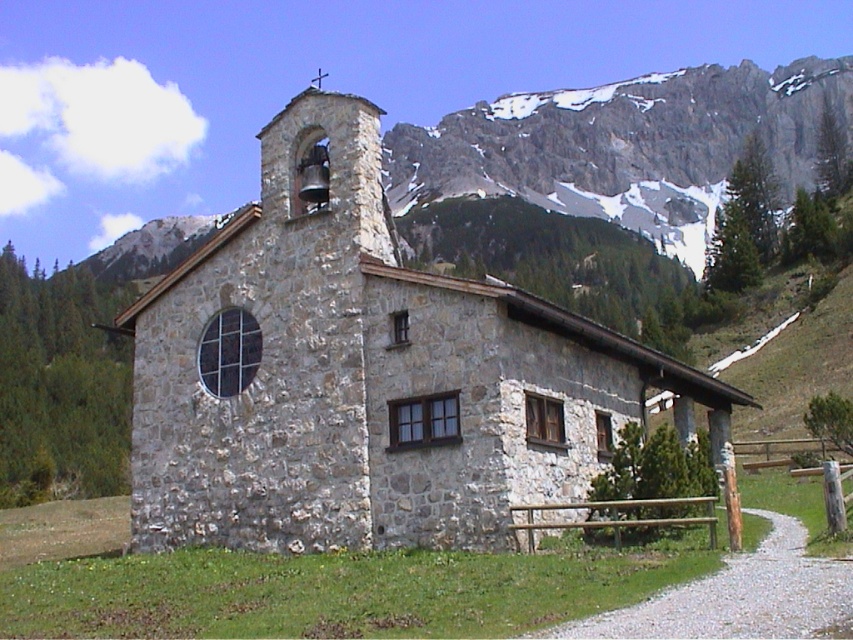
Question: From the image, what is the correct spatial relationship of stone church at center in relation to gray rocky mountain at upper center?

Choices:
 (A) above
 (B) below

Answer: (B)

Question: Is stone church at center bigger than gray rocky mountain at upper center?

Choices:
 (A) no
 (B) yes

Answer: (A)

Question: Which point is farther to the camera?

Choices:
 (A) (698, 262)
 (B) (550, 364)

Answer: (A)

Question: Which point is farther to the camera?

Choices:
 (A) stone church at center
 (B) gray rocky mountain at upper center

Answer: (B)

Question: Can you confirm if stone church at center is positioned above gray rocky mountain at upper center?

Choices:
 (A) yes
 (B) no

Answer: (B)